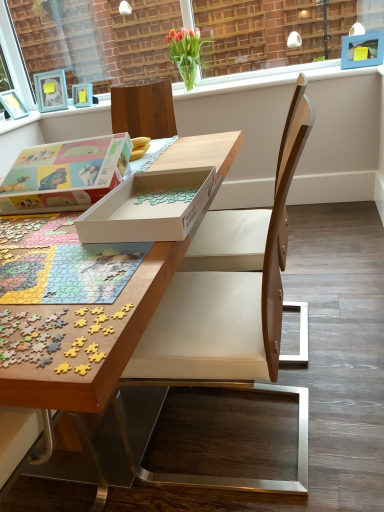
Question: Is blue plastic picture frame at upper right, the 2th picture frame in the left-to-right sequence, facing away from wooden chair at center?

Choices:
 (A) yes
 (B) no

Answer: (B)

Question: Would you consider blue plastic picture frame at upper right, the 2th picture frame in the left-to-right sequence, to be distant from wooden chair at center?

Choices:
 (A) no
 (B) yes

Answer: (B)

Question: Can you confirm if blue plastic picture frame at upper right, placed as the 1th picture frame when sorted from right to left, is taller than wooden chair at center?

Choices:
 (A) no
 (B) yes

Answer: (A)

Question: Considering the relative positions of blue plastic picture frame at upper right, placed as the 1th picture frame when sorted from right to left, and wooden chair at center in the image provided, is blue plastic picture frame at upper right, placed as the 1th picture frame when sorted from right to left, to the left of wooden chair at center from the viewer's perspective?

Choices:
 (A) no
 (B) yes

Answer: (A)

Question: Is blue plastic picture frame at upper right, which ranks as the second picture frame in back-to-front order, in contact with wooden chair at center?

Choices:
 (A) no
 (B) yes

Answer: (A)

Question: In the image, is vivid tulips in glass vase at upper center positioned in front of or behind white matte window sill at upper center?

Choices:
 (A) front
 (B) behind

Answer: (B)

Question: From the image's perspective, is vivid tulips in glass vase at upper center positioned above or below white matte window sill at upper center?

Choices:
 (A) below
 (B) above

Answer: (B)

Question: Is vivid tulips in glass vase at upper center spatially inside white matte window sill at upper center, or outside of it?

Choices:
 (A) inside
 (B) outside

Answer: (B)

Question: Considering the positions of vivid tulips in glass vase at upper center and white matte window sill at upper center in the image, is vivid tulips in glass vase at upper center wider or thinner than white matte window sill at upper center?

Choices:
 (A) thin
 (B) wide

Answer: (B)

Question: Is vivid tulips in glass vase at upper center bigger or smaller than wooden chair at center?

Choices:
 (A) small
 (B) big

Answer: (A)

Question: Based on their positions, is vivid tulips in glass vase at upper center located to the left or right of wooden chair at center?

Choices:
 (A) left
 (B) right

Answer: (A)

Question: Is point (170, 45) positioned closer to the camera than point (236, 351)?

Choices:
 (A) closer
 (B) farther

Answer: (B)

Question: Considering their positions, is vivid tulips in glass vase at upper center located in front of or behind wooden chair at center?

Choices:
 (A) behind
 (B) front

Answer: (A)

Question: Is white matte window sill at upper center situated inside wooden puzzle pieces at center or outside?

Choices:
 (A) inside
 (B) outside

Answer: (B)

Question: From a real-world perspective, is white matte window sill at upper center physically located above or below wooden puzzle pieces at center?

Choices:
 (A) above
 (B) below

Answer: (A)